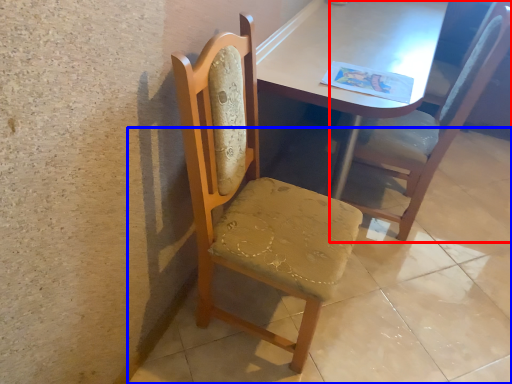
Question: Which object is further to the camera taking this photo, chair (highlighted by a red box) or concrete (highlighted by a blue box)?

Choices:
 (A) chair
 (B) concrete

Answer: (A)